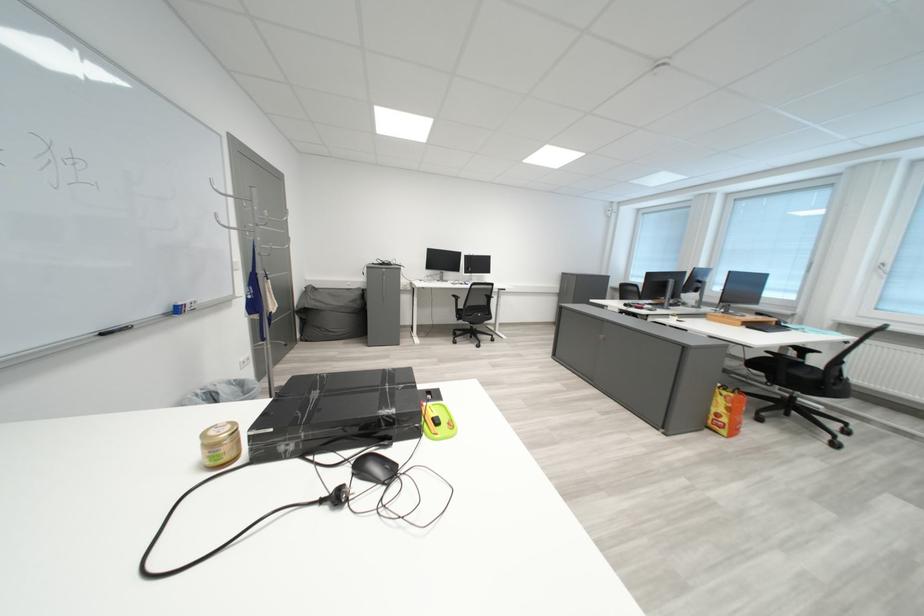
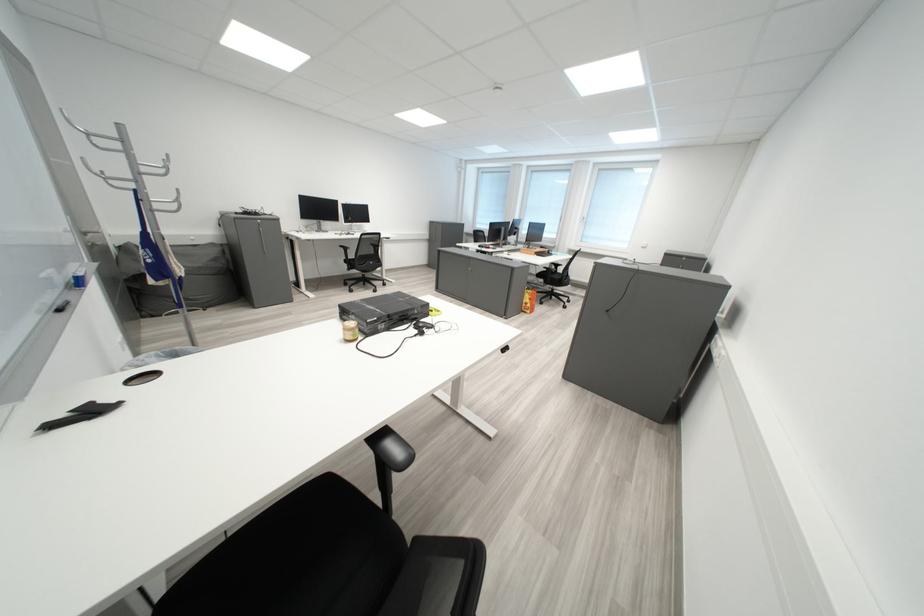
The point at (845,516) is marked in the first image. Where is the corresponding point in the second image?

(574, 333)